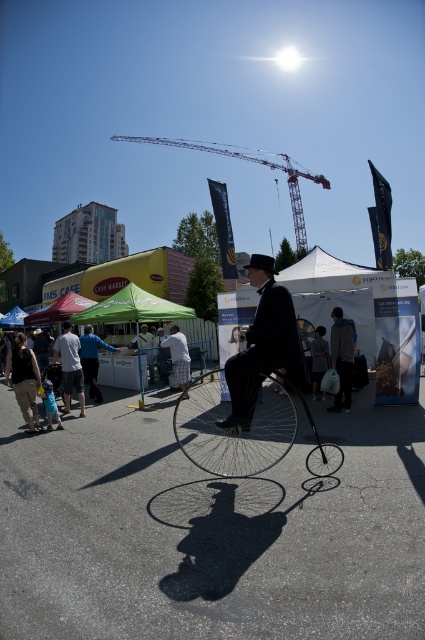
Does dark brown leather pants at lower left come in front of green fabric canopy at center?

That is True.

Is dark brown leather pants at lower left thinner than green fabric canopy at center?

Indeed, dark brown leather pants at lower left has a lesser width compared to green fabric canopy at center.

Identify the location of dark brown leather pants at lower left. The image size is (425, 640). (23, 380).

You are a GUI agent. You are given a task and a screenshot of the screen. Output one action in this format:
    pyautogui.click(x=<x>, y=<y>)
    Task: Click on the dark brown leather pants at lower left
    This screenshot has width=425, height=640.
    Given the screenshot: What is the action you would take?
    pyautogui.click(x=23, y=380)

Does black matte bicycle at center have a lesser height compared to metallic red crane at upper center?

Indeed, black matte bicycle at center has a lesser height compared to metallic red crane at upper center.

Between point (261, 419) and point (175, 145), which one is positioned in front?

Positioned in front is point (261, 419).

Locate an element on the screen. This screenshot has width=425, height=640. black matte bicycle at center is located at coordinates (246, 429).

Does matte black suit at center have a lesser width compared to dark brown leather pants at lower left?

In fact, matte black suit at center might be wider than dark brown leather pants at lower left.

Is matte black suit at center smaller than dark brown leather pants at lower left?

Actually, matte black suit at center might be larger than dark brown leather pants at lower left.

Measure the distance between point (x=272, y=269) and camera.

A distance of 4.30 meters exists between point (x=272, y=269) and camera.

The image size is (425, 640). In order to click on matte black suit at center in this screenshot , I will do `click(263, 344)`.